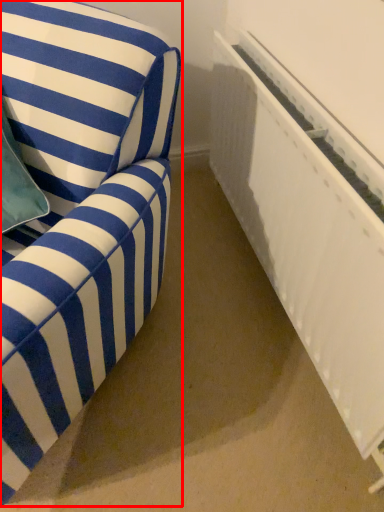
Question: In this image, where is furniture (annotated by the red box) located relative to radiator?

Choices:
 (A) left
 (B) right

Answer: (A)